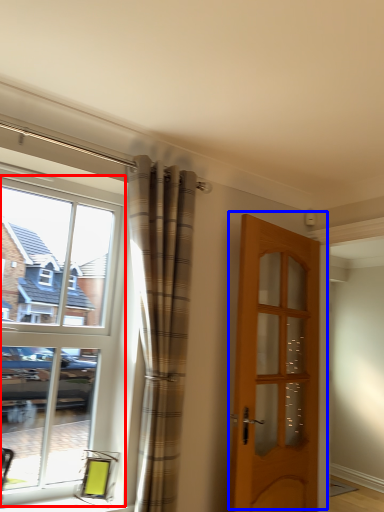
Question: Among these objects, which one is farthest to the camera, window (highlighted by a red box) or door (highlighted by a blue box)?

Choices:
 (A) window
 (B) door

Answer: (B)